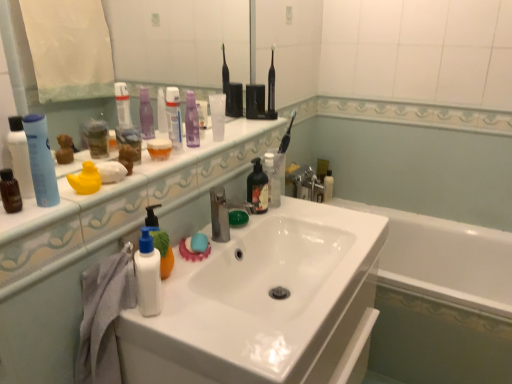
Question: Does point (18, 190) appear closer or farther from the camera than point (151, 256)?

Choices:
 (A) farther
 (B) closer

Answer: (B)

Question: Choose the correct answer: Is brown matte bottle at left, positioned as the 6th mouthwash in back-to-front order, inside white matte lotion at center, the third toiletry viewed from the left, or outside it?

Choices:
 (A) outside
 (B) inside

Answer: (A)

Question: Which object is the closest to the purple matte lotion at center, marked as the 2th toiletry in a back-to-front arrangement?

Choices:
 (A) translucent plastic bottle at center, which ranks as the fifth toiletry in left-to-right order
 (B) white glossy sink at center
 (C) white glossy counter top at upper center
 (D) translucent rubber soap at sink
 (E) translucent plastic bottle at center, which is the 5th mouthwash from left to right

Answer: (C)

Question: Which of these objects is positioned farthest from the translucent rubber soap at sink?

Choices:
 (A) white glossy counter top at upper center
 (B) translucent plastic bottle at center, marked as the second mouthwash in a right-to-left arrangement
 (C) clear glass mirror at upper center
 (D) rubber duck at left, which is counted as the 3th toiletry, starting from the back
 (E) gray fabric towel at left

Answer: (C)